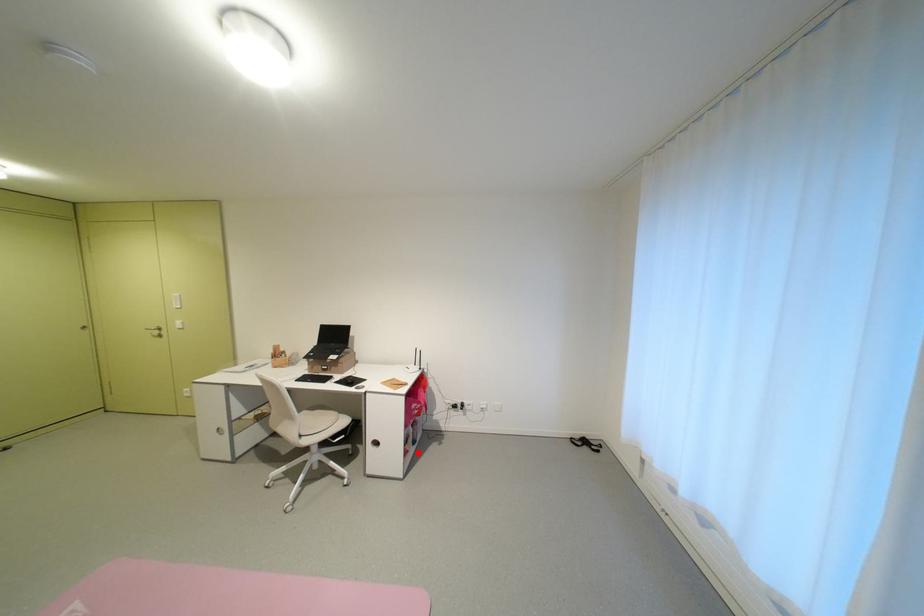
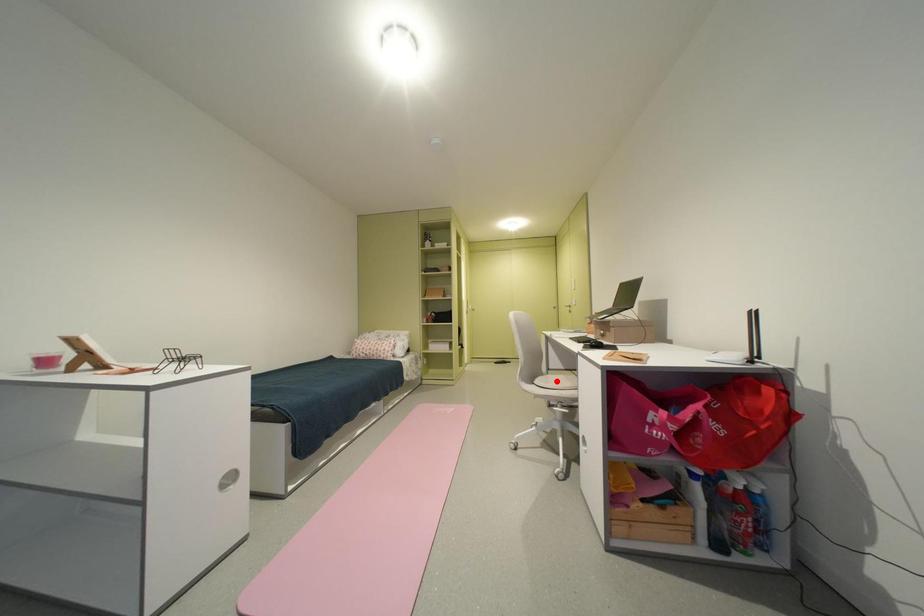
I am providing you with two images of the same scene from different viewpoints. A red point is marked on the first image and another point is marked on the second image. Is the marked point in image1 the same physical position as the marked point in image2?

No